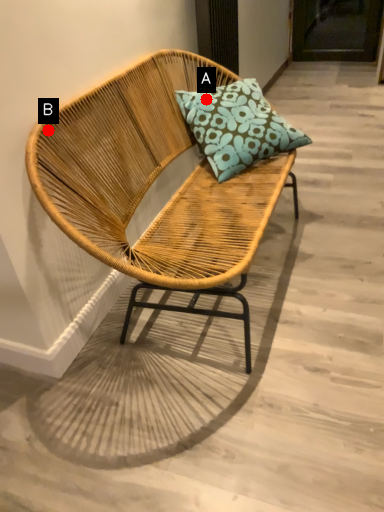
Question: Two points are circled on the image, labeled by A and B beside each circle. Which point is farther to the camera?

Choices:
 (A) A is further
 (B) B is further

Answer: (A)